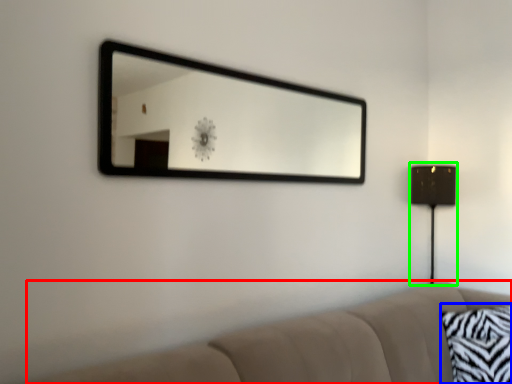
Question: Which object is positioned farthest from studio couch (highlighted by a red box)? Select from pillow (highlighted by a blue box) and table lamp (highlighted by a green box).

Choices:
 (A) pillow
 (B) table lamp

Answer: (B)